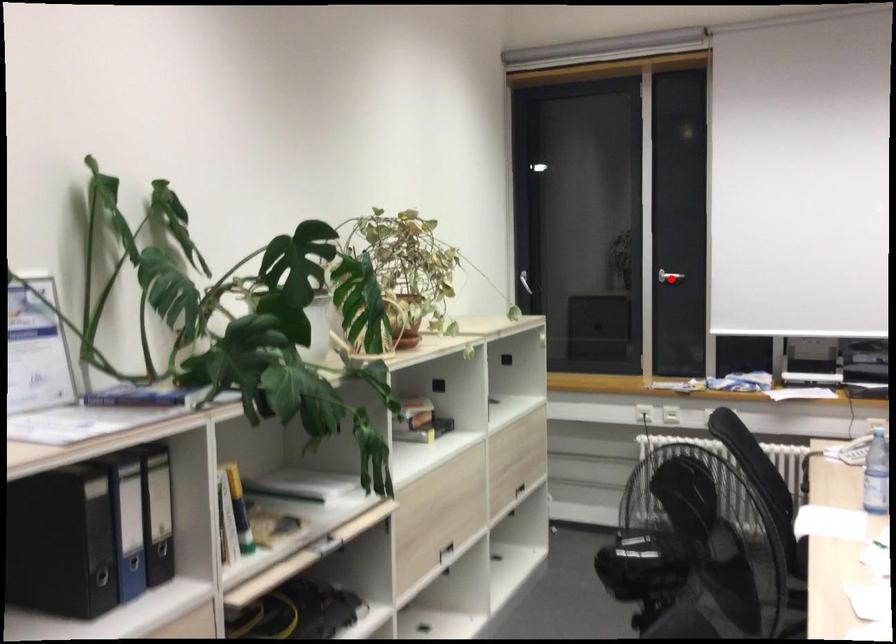
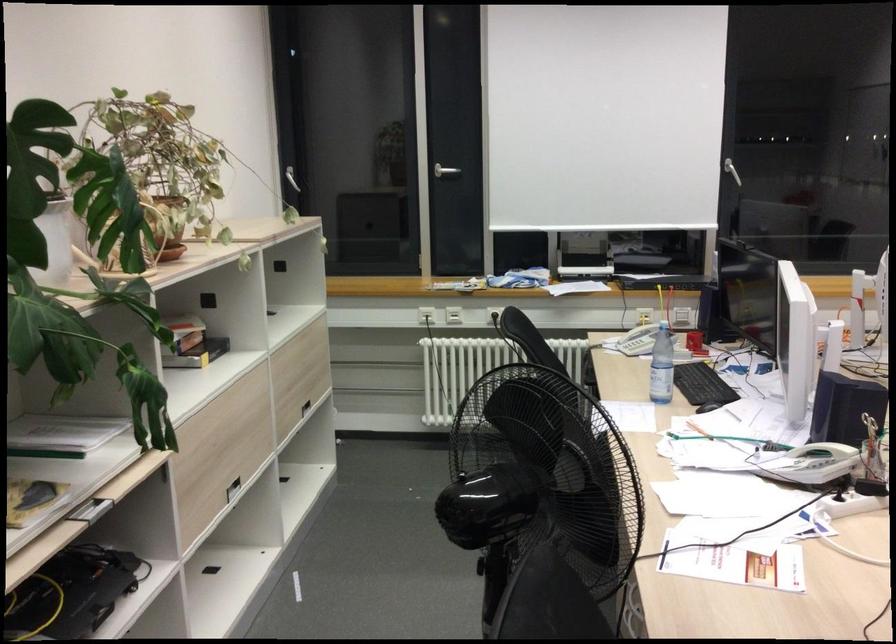
Locate, in the second image, the point that corresponds to the highlighted location in the first image.

(445, 171)